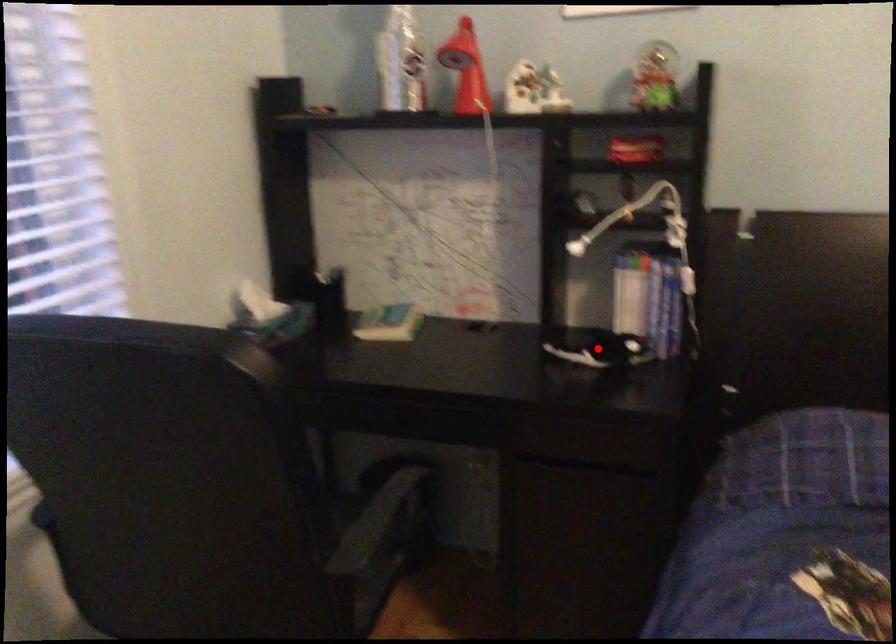
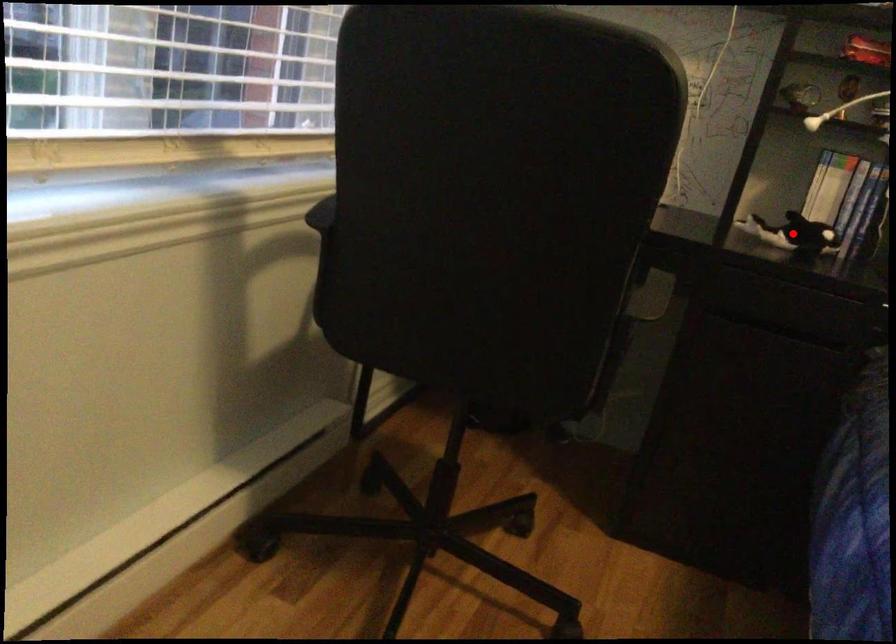
I am providing you with two images of the same scene from different viewpoints. A red point is marked on the first image and another point is marked on the second image. Are the points marked in image1 and image2 representing the same 3D position?

Yes